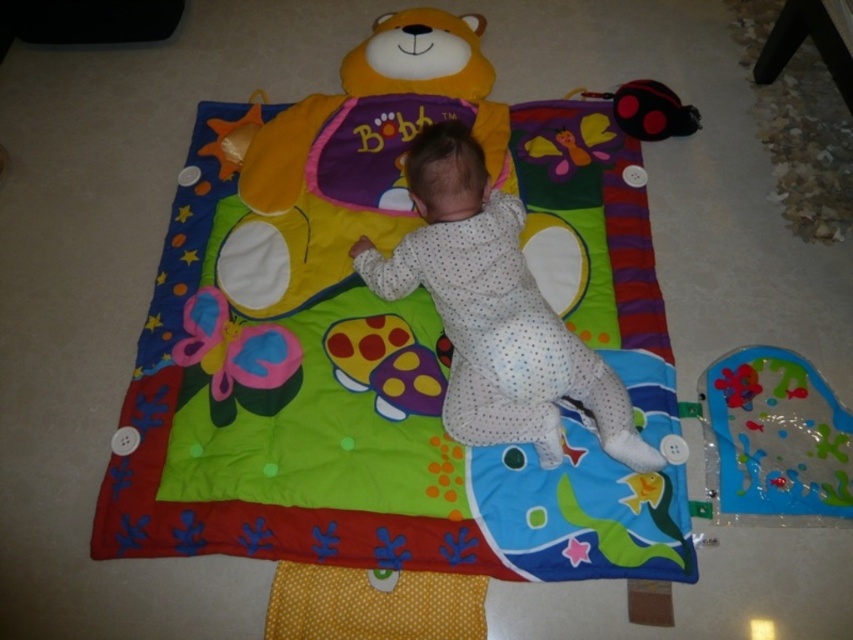
You are a parent trying to choose a toy for your baby. You have two options on the play mat. Which toy is larger in size between the transparent plastic fish at lower right and the matte plastic butterfly at center?

The transparent plastic fish at lower right is bigger than the matte plastic butterfly at center.

You are a parent trying to distract your baby with the transparent plastic fish at lower right and the matte plastic butterfly at center. Which toy is closer to the right edge of the play mat?

The transparent plastic fish at lower right is positioned on the right side of the matte plastic butterfly at center, so it is closer to the right edge of the play mat.

You are a parent trying to distract your baby with a toy. The baby is currently looking at the matte plastic mushroom at center. You have a rattle that you want to move closer to the transparent plastic fish at lower right. Will moving the rattle towards the fish make it move away from the mushroom?

The transparent plastic fish at lower right is closer to the viewer than the matte plastic mushroom at center. Moving the rattle towards the fish would mean moving it in the direction of the closer object, so it would move away from the mushroom which is further away.